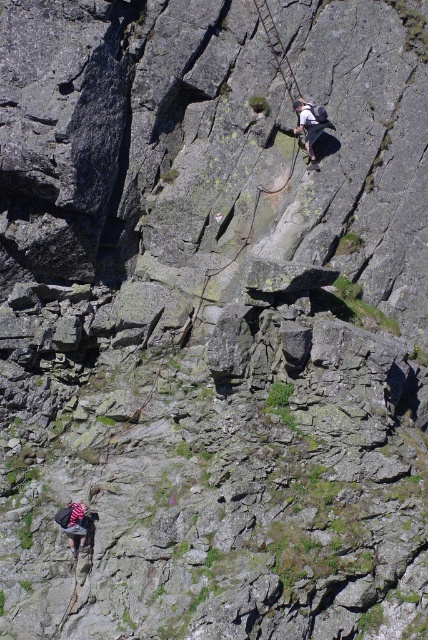
Question: Does matte gray climbing harness at upper center have a smaller size compared to dark gray fabric backpack at lower left?

Choices:
 (A) no
 (B) yes

Answer: (A)

Question: Does matte gray climbing harness at upper center have a lesser width compared to dark gray fabric backpack at lower left?

Choices:
 (A) no
 (B) yes

Answer: (A)

Question: Which point is closer to the camera?

Choices:
 (A) (70, 518)
 (B) (321, 125)

Answer: (A)

Question: Is matte gray climbing harness at upper center thinner than dark gray fabric backpack at lower left?

Choices:
 (A) yes
 (B) no

Answer: (B)

Question: Which object is farther from the camera taking this photo?

Choices:
 (A) matte gray climbing harness at upper center
 (B) dark gray fabric backpack at lower left

Answer: (A)

Question: Which point appears farthest from the camera in this image?

Choices:
 (A) (315, 113)
 (B) (86, 512)

Answer: (A)